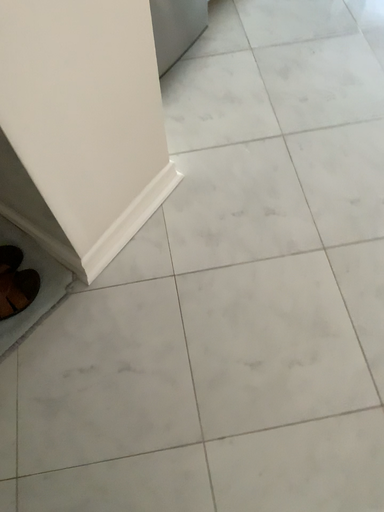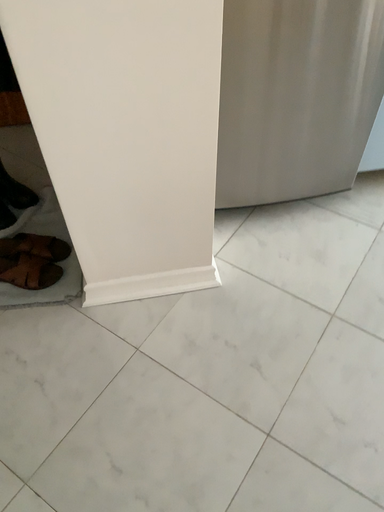
Question: How did the camera likely rotate when shooting the video?

Choices:
 (A) rotated downward
 (B) rotated upward

Answer: (B)